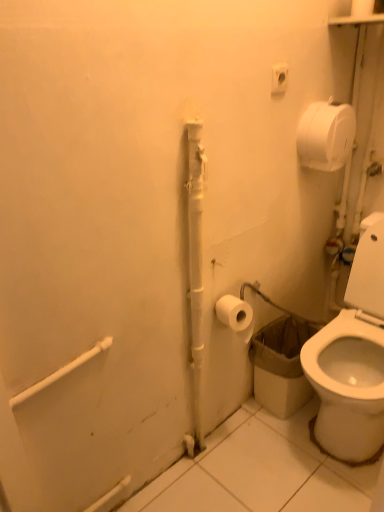
Question: Considering the positions of point (276, 77) and point (317, 153), is point (276, 77) closer or farther from the camera than point (317, 153)?

Choices:
 (A) closer
 (B) farther

Answer: (A)

Question: From a real-world perspective, is white plastic outlet at upper center physically located above or below white matte toilet paper at upper right, positioned as the first toilet paper in top-to-bottom order?

Choices:
 (A) above
 (B) below

Answer: (A)

Question: Which is farther from the white matte toilet paper at upper right, positioned as the first toilet paper in top-to-bottom order?

Choices:
 (A) white matte pipe at center
 (B) white plastic outlet at upper center
 (C) white matte toilet paper at lower right, arranged as the first toilet paper when viewed from the left

Answer: (C)

Question: Considering the real-world distances, which object is farthest from the white plastic outlet at upper center?

Choices:
 (A) white matte toilet paper at upper right, the 2th toilet paper in the bottom-to-top sequence
 (B) white matte toilet paper at lower right, positioned as the second toilet paper in top-to-bottom order
 (C) white matte pipe at center

Answer: (B)